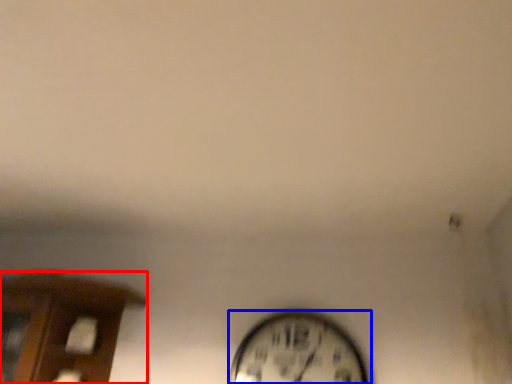
Question: Among these objects, which one is farthest to the camera, furniture (highlighted by a red box) or wall clock (highlighted by a blue box)?

Choices:
 (A) furniture
 (B) wall clock

Answer: (B)